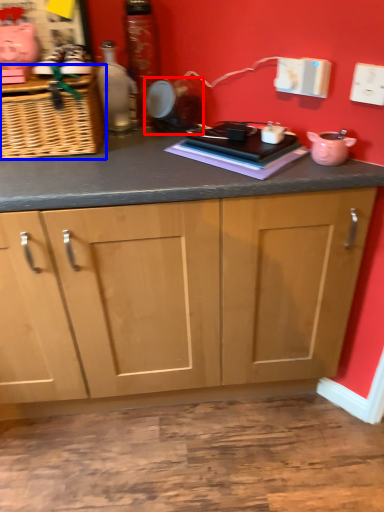
Question: Which of the following is the closest to the observer, appliance (highlighted by a red box) or basket (highlighted by a blue box)?

Choices:
 (A) appliance
 (B) basket

Answer: (B)